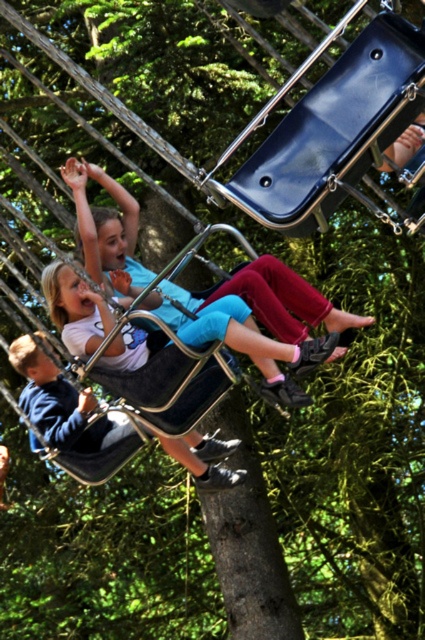
Is matte black swing at lower left shorter than blue denim jeans at lower left?

No.

I want to click on matte black swing at lower left, so click(x=61, y=403).

Can you confirm if matte blue pants at center is taller than blue denim jeans at lower left?

Correct, matte blue pants at center is much taller as blue denim jeans at lower left.

Does matte blue pants at center have a lesser height compared to blue denim jeans at lower left?

No.

Which is in front, point (275, 266) or point (74, 394)?

Point (275, 266)

The width and height of the screenshot is (425, 640). Find the location of `matte blue pants at center`. matte blue pants at center is located at coordinates (102, 224).

Who is more forward, (19, 406) or (127, 221)?

Point (19, 406)

Which of these two, matte black swing at lower left or matte blue pants at center, stands shorter?

With less height is matte blue pants at center.

The width and height of the screenshot is (425, 640). What are the coordinates of `matte black swing at lower left` in the screenshot? It's located at (61, 403).